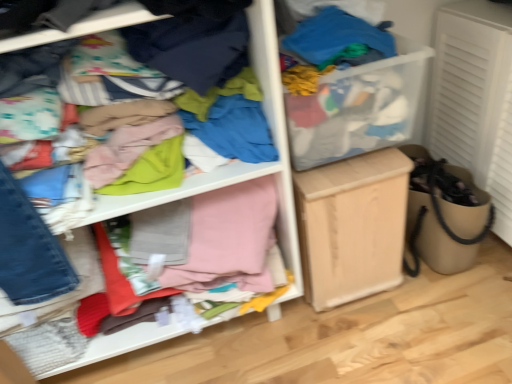
The image size is (512, 384). Find the location of `empty space that is ontop of light wood cabinet at center (from a real-world perspective)`. empty space that is ontop of light wood cabinet at center (from a real-world perspective) is located at coordinates (353, 163).